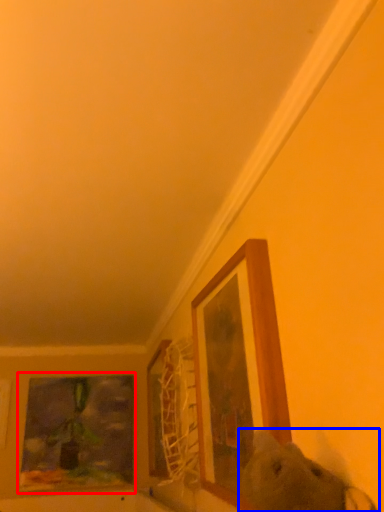
Question: Which object appears closest to the camera in this image, picture frame (highlighted by a red box) or animal (highlighted by a blue box)?

Choices:
 (A) picture frame
 (B) animal

Answer: (B)